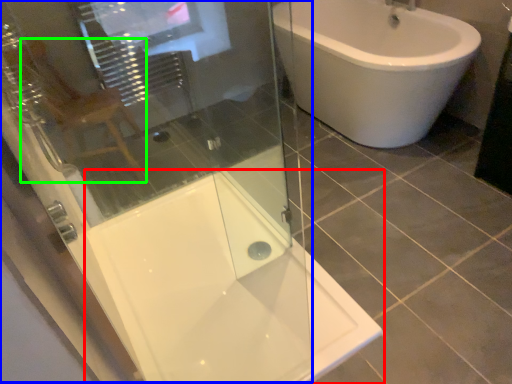
Question: Based on their relative distances, which object is nearer to bath (highlighted by a red box)? Choose from screen door (highlighted by a blue box) and gray (highlighted by a green box).

Choices:
 (A) screen door
 (B) gray

Answer: (A)